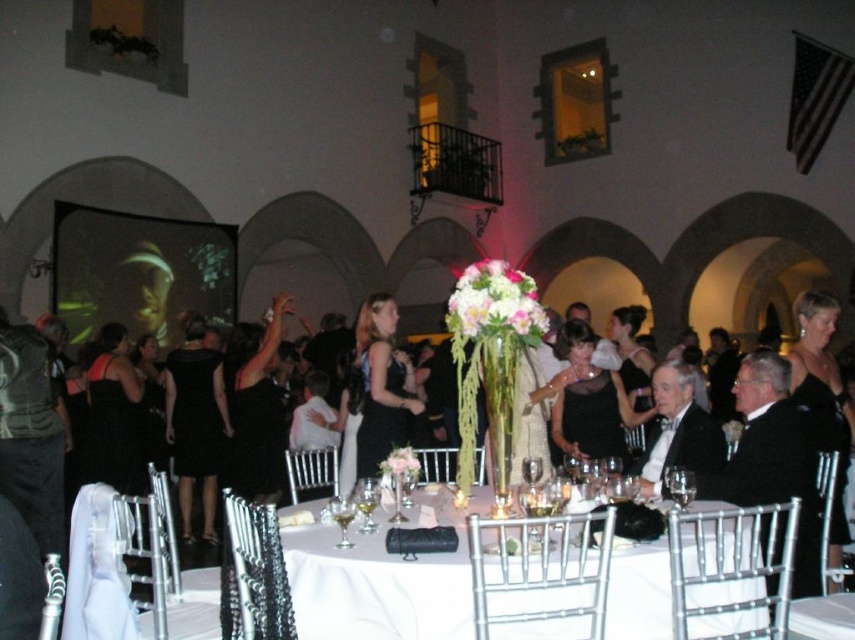
You are standing at the position of point (345, 524) and want to walk straight towards the direction of point (450, 298). Is there any obstruction between these two points?

Yes, since point (450, 298) is behind point (345, 524), there is an obstruction between them.

Based on the photo, you are a guest at this event and want to find your seat. You see the white cloth table at center and the pale pink silk flower at center. Which object is closer to the right side of the image?

The white cloth table at center is closer to the right side of the image because it is positioned to the right of the pale pink silk flower at center.

You are a guest at this event and notice two flowers on the table. The white silk bouquet at center and the pale pink silk flower at center. Which one is positioned to the right of the other?

The white silk bouquet at center is to the right of the pale pink silk flower at center.